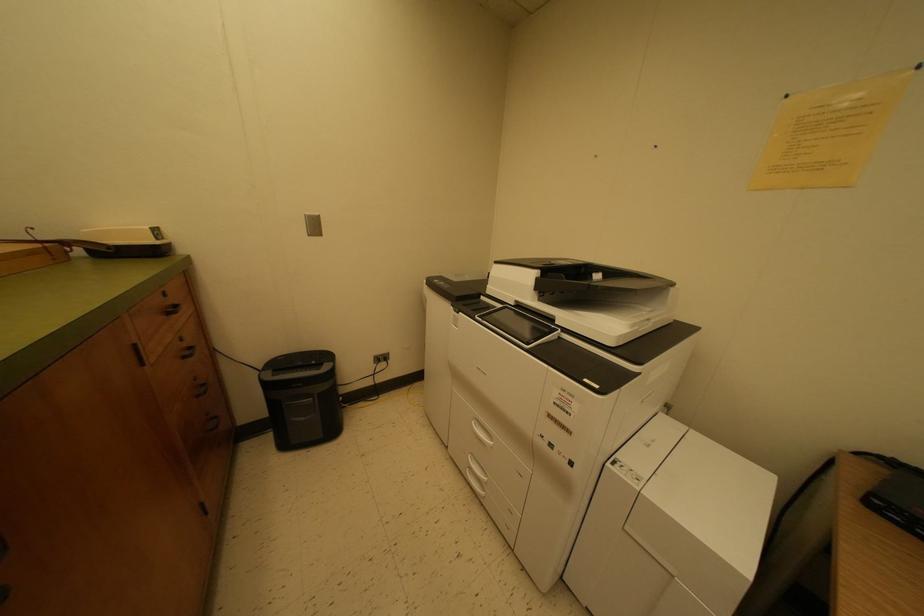
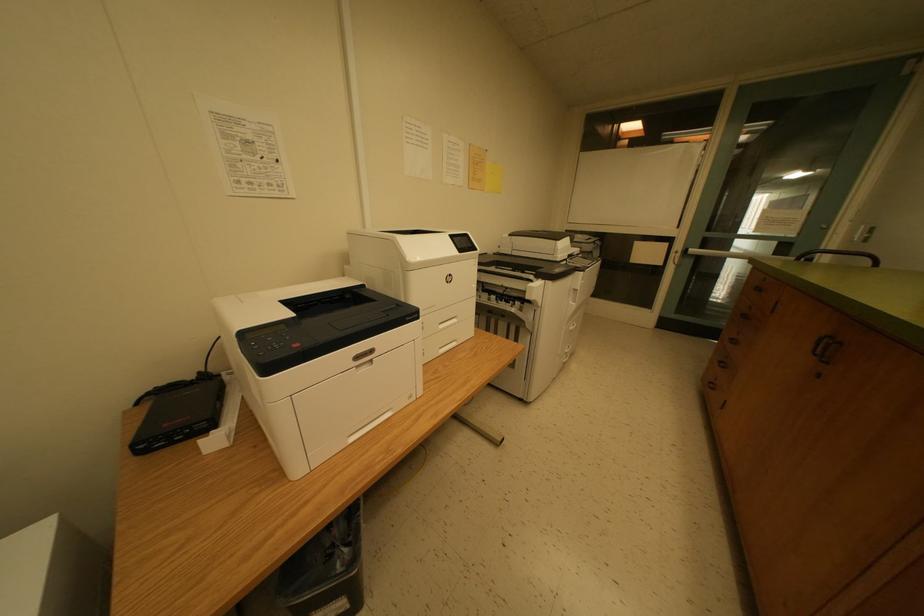
How did the camera likely rotate?

The camera's rotation is toward right-down.